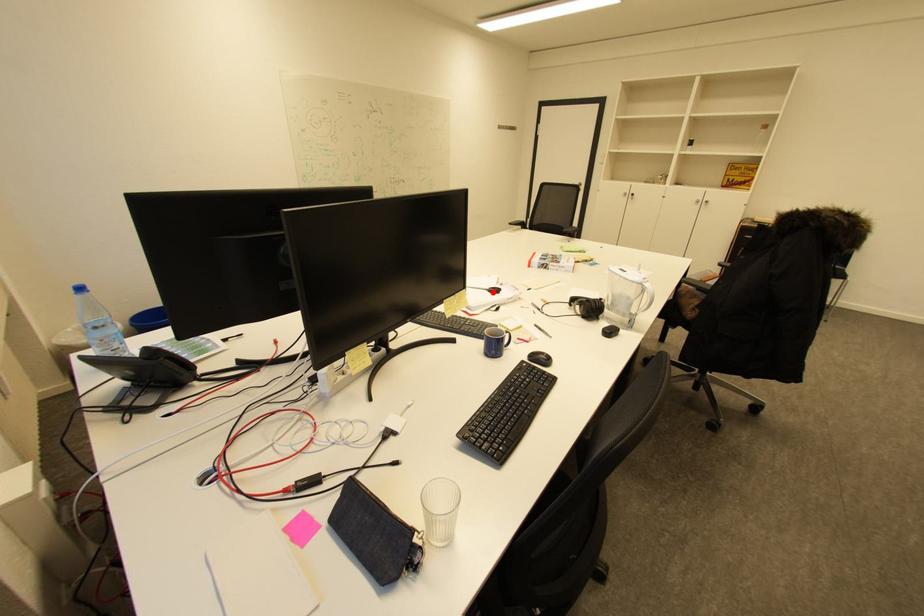
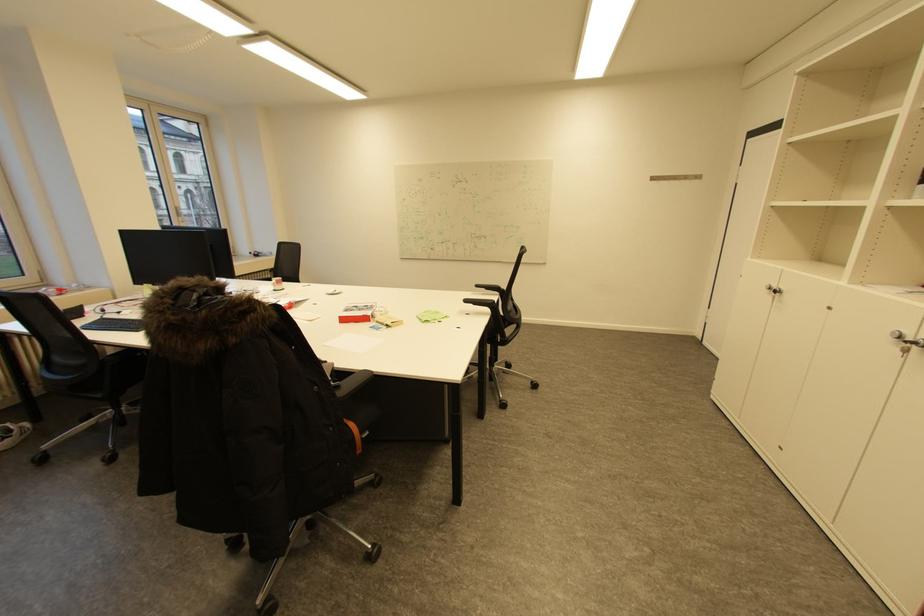
Question: I am providing you with two images of the same scene from different viewpoints. A red point is marked on the first image. Can you still see the location of the red point in image 2?

Choices:
 (A) Yes
 (B) No

Answer: (B)